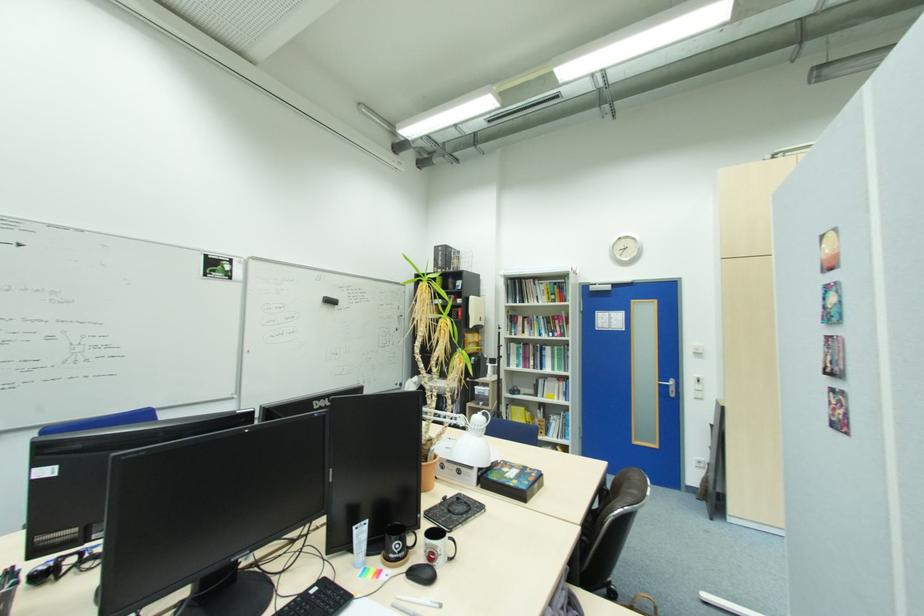
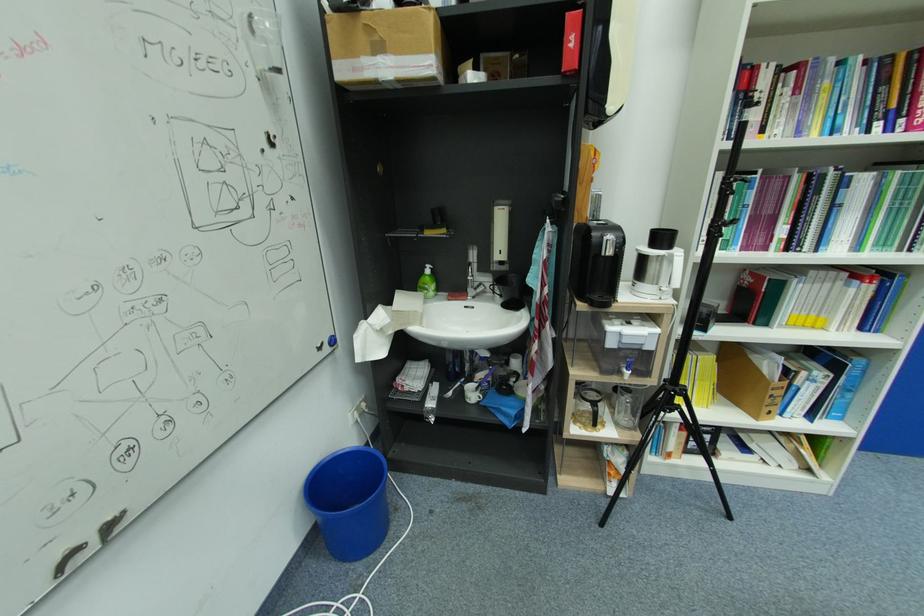
Find the pixel in the second image that matches point (482, 395) in the first image.

(623, 350)